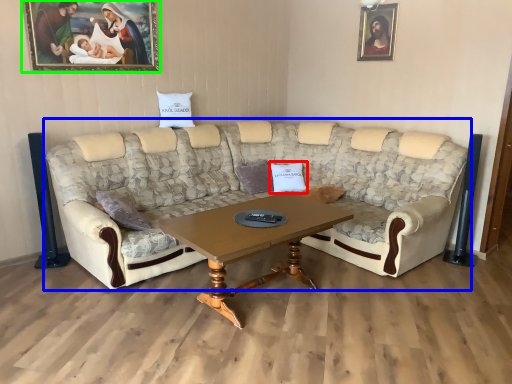
Question: Estimate the real-world distances between objects in this image. Which object is closer to pillow (highlighted by a red box), studio couch (highlighted by a blue box) or picture frame (highlighted by a green box)?

Choices:
 (A) studio couch
 (B) picture frame

Answer: (A)